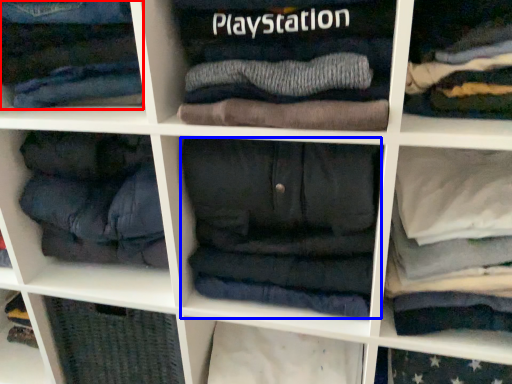
Question: Which object appears closest to the camera in this image, clothing (highlighted by a red box) or clothing (highlighted by a blue box)?

Choices:
 (A) clothing
 (B) clothing

Answer: (A)